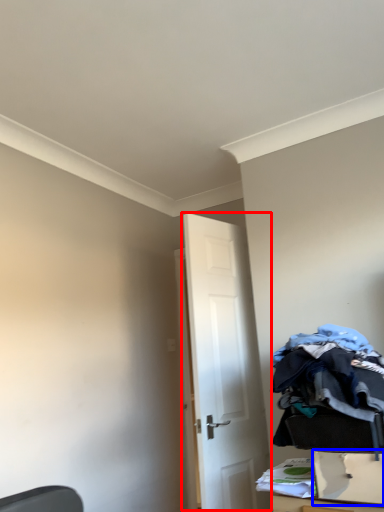
Question: Which point is further to the camera, door (highlighted by a red box) or drawer (highlighted by a blue box)?

Choices:
 (A) door
 (B) drawer

Answer: (A)